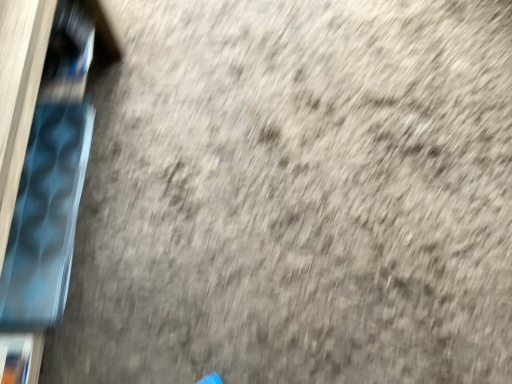
This screenshot has height=384, width=512. What do you see at coordinates (19, 92) in the screenshot?
I see `blue fabric at left` at bounding box center [19, 92].

Where is `blue fabric at left`? blue fabric at left is located at coordinates (19, 92).

Where is `blue fabric at left`? The width and height of the screenshot is (512, 384). blue fabric at left is located at coordinates (19, 92).